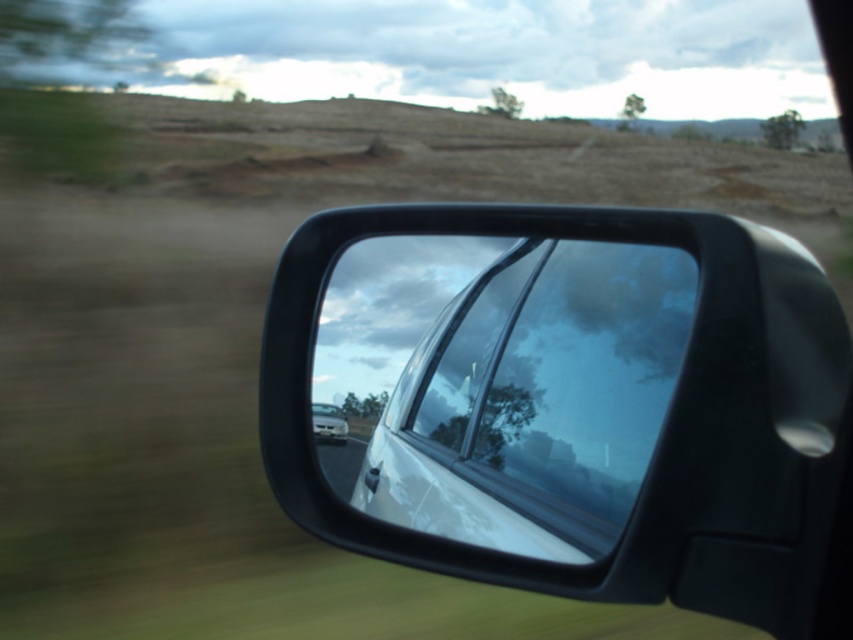
Question: Considering the relative positions of clear glass car window at center and white glossy car at center in the image provided, where is clear glass car window at center located with respect to white glossy car at center?

Choices:
 (A) above
 (B) below

Answer: (A)

Question: Among these objects, which one is farthest from the camera?

Choices:
 (A) glossy black car mirror at right
 (B) clear glass car window at center

Answer: (B)

Question: Which point is closer to the camera?

Choices:
 (A) (341, 416)
 (B) (593, 412)

Answer: (B)

Question: Considering the relative positions of glossy black car mirror at right and white glossy car at center in the image provided, where is glossy black car mirror at right located with respect to white glossy car at center?

Choices:
 (A) above
 (B) below

Answer: (A)

Question: Which object is positioned closest to the white glossy car at center?

Choices:
 (A) glossy black car mirror at right
 (B) clear glass car window at center

Answer: (A)

Question: Does glossy black car mirror at right have a lesser width compared to clear glass car window at center?

Choices:
 (A) yes
 (B) no

Answer: (B)